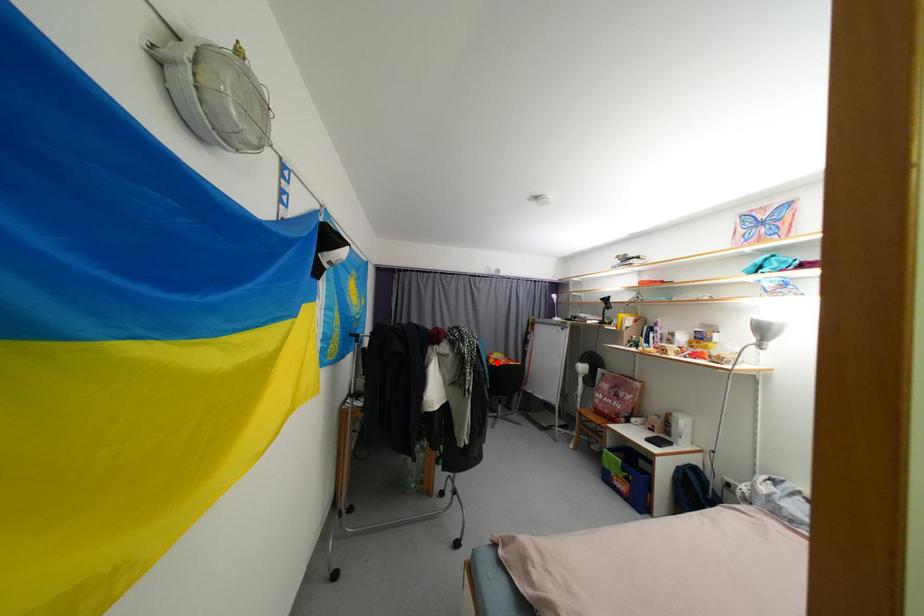
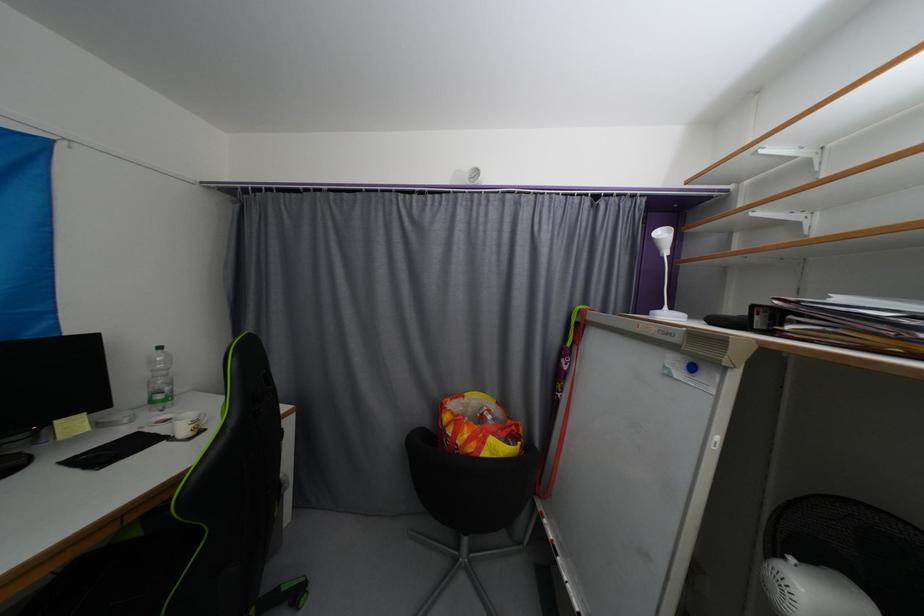
Locate, in the second image, the point that corresponds to the highlighted location in the first image.

(452, 419)